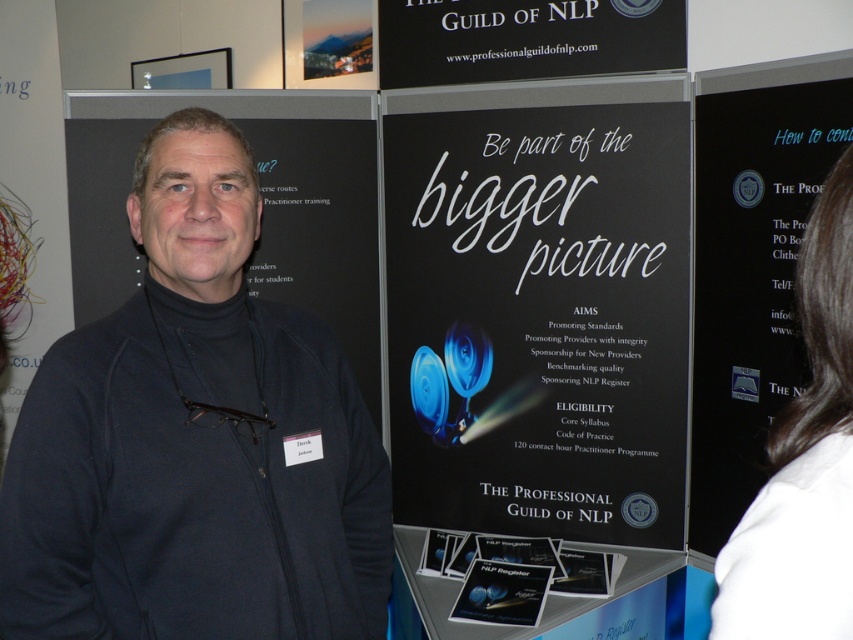
Question: Does dark blue fleece at left have a larger size compared to white fabric hair at upper right?

Choices:
 (A) no
 (B) yes

Answer: (B)

Question: Among these objects, which one is nearest to the camera?

Choices:
 (A) white fabric hair at upper right
 (B) black matte sign at upper center

Answer: (A)

Question: Among these objects, which one is farthest from the camera?

Choices:
 (A) dark blue fleece at left
 (B) black paper poster at center

Answer: (B)

Question: In this image, where is white fabric hair at upper right located relative to black matte sign at upper center?

Choices:
 (A) above
 (B) below

Answer: (B)

Question: Does dark blue fleece at left have a smaller size compared to white fabric hair at upper right?

Choices:
 (A) yes
 (B) no

Answer: (B)

Question: Which of the following is the farthest from the observer?

Choices:
 (A) dark blue fleece at left
 (B) black paper poster at center
 (C) white fabric hair at upper right
 (D) black matte sign at upper center

Answer: (B)